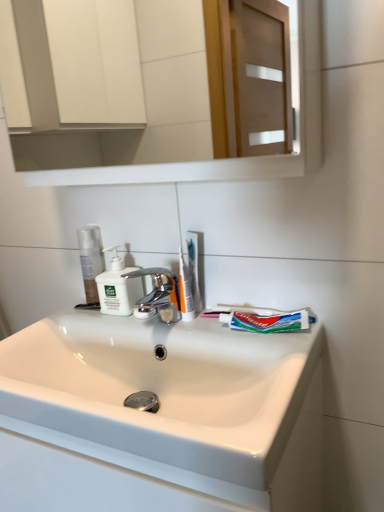
Identify the location of free space in front of translucent plastic toothbrush at center. This screenshot has height=512, width=384. click(x=225, y=337).